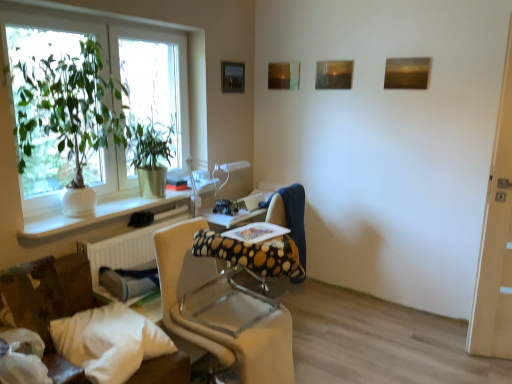
Describe the element at coordinates (95, 215) in the screenshot. The image size is (512, 384). I see `white ceramic pot at left` at that location.

What is the approximate height of matte wooden picture frame at upper center, which is the 2th picture frame in left-to-right order?

9.15 inches.

What do you see at coordinates (284, 75) in the screenshot?
I see `matte wooden picture frame at upper center, which is the 2th picture frame in left-to-right order` at bounding box center [284, 75].

What do you see at coordinates (109, 341) in the screenshot? Image resolution: width=512 pixels, height=384 pixels. I see `white fabric pillow at lower left` at bounding box center [109, 341].

What do you see at coordinates (150, 154) in the screenshot? I see `green glossy plant at left, positioned as the 1th houseplant in back-to-front order` at bounding box center [150, 154].

Describe the element at coordinates (69, 115) in the screenshot. I see `green leafy plant at left, arranged as the 2th houseplant when viewed from the back` at that location.

Locate an element on the screen. The image size is (512, 384). matte wooden picture frame at upper center, which is the second picture frame in right-to-left order is located at coordinates (334, 74).

Image resolution: width=512 pixels, height=384 pixels. I want to click on white ceramic pot at left, so click(95, 215).

Choose the correct answer: Is wooden textured painting at upper right, placed as the 4th picture frame when sorted from left to right, inside white fabric pillow at lower left or outside it?

wooden textured painting at upper right, placed as the 4th picture frame when sorted from left to right, lies outside white fabric pillow at lower left.

From a real-world perspective, which object rests below the other?

white fabric pillow at lower left is physically lower.

Is wooden textured painting at upper right, placed as the 4th picture frame when sorted from left to right, taller or shorter than white fabric pillow at lower left?

Clearly, wooden textured painting at upper right, placed as the 4th picture frame when sorted from left to right, is taller compared to white fabric pillow at lower left.

Looking at this image, between wooden textured painting at upper right, placed as the 4th picture frame when sorted from left to right, and white fabric pillow at lower left, which one has smaller size?

wooden textured painting at upper right, placed as the 4th picture frame when sorted from left to right.

Is white ceramic pot at left aimed at metallic rectangular frame at upper center, the fourth picture frame in the right-to-left sequence?

No, white ceramic pot at left is not aimed at metallic rectangular frame at upper center, the fourth picture frame in the right-to-left sequence.

Is white ceramic pot at left placed right next to metallic rectangular frame at upper center, the fourth picture frame in the right-to-left sequence?

white ceramic pot at left and metallic rectangular frame at upper center, the fourth picture frame in the right-to-left sequence, are clearly separated.

Considering the positions of point (110, 202) and point (241, 74), is point (110, 202) closer or farther from the camera than point (241, 74)?

Point (110, 202).

How distant is metallic rectangular frame at upper center, the fourth picture frame in the right-to-left sequence, from beige fabric chair at center?

1.83 meters.

From a real-world perspective, between metallic rectangular frame at upper center, the fourth picture frame in the right-to-left sequence, and beige fabric chair at center, who is vertically lower?

beige fabric chair at center, from a real-world perspective.

Does metallic rectangular frame at upper center, the fourth picture frame in the right-to-left sequence, have a larger size compared to beige fabric chair at center?

Incorrect, metallic rectangular frame at upper center, the fourth picture frame in the right-to-left sequence, is not larger than beige fabric chair at center.

From a real-world perspective, which object stands above the other?

white fabric pillow at lower left.

Does point (283, 367) appear closer or farther from the camera than point (70, 360)?

Clearly, point (283, 367) is more distant from the camera than point (70, 360).

Who is more distant, beige fabric chair at center or white fabric pillow at lower left?

beige fabric chair at center is further from the camera.

From the image's perspective, between beige fabric chair at center and white fabric pillow at lower left, which one is located above?

beige fabric chair at center.

Between wooden textured painting at upper right, which is the 1th picture frame in right-to-left order, and white textured radiator at lower left, which one appears on the right side from the viewer's perspective?

From the viewer's perspective, wooden textured painting at upper right, which is the 1th picture frame in right-to-left order, appears more on the right side.

Based on the photo, considering the sizes of objects wooden textured painting at upper right, which is the 1th picture frame in right-to-left order, and white textured radiator at lower left in the image provided, who is thinner, wooden textured painting at upper right, which is the 1th picture frame in right-to-left order, or white textured radiator at lower left?

With smaller width is wooden textured painting at upper right, which is the 1th picture frame in right-to-left order.

Who is shorter, wooden textured painting at upper right, which is the 1th picture frame in right-to-left order, or white textured radiator at lower left?

wooden textured painting at upper right, which is the 1th picture frame in right-to-left order.

Would you say matte wooden picture frame at upper center, which is the second picture frame in right-to-left order, is to the left or to the right of white ceramic pot at left in the picture?

matte wooden picture frame at upper center, which is the second picture frame in right-to-left order, is to the right of white ceramic pot at left.

You are a GUI agent. You are given a task and a screenshot of the screen. Output one action in this format:
    pyautogui.click(x=<x>, y=<y>)
    Task: Click on the window sill in front of the matte wooden picture frame at upper center, which is the second picture frame in right-to-left order
    The width and height of the screenshot is (512, 384).
    Given the screenshot: What is the action you would take?
    pyautogui.click(x=95, y=215)

Is matte wooden picture frame at upper center, positioned as the third picture frame in left-to-right order, not close to white ceramic pot at left?

That's right, there is a large distance between matte wooden picture frame at upper center, positioned as the third picture frame in left-to-right order, and white ceramic pot at left.

Considering the relative positions of metallic rectangular frame at upper center, the fourth picture frame in the right-to-left sequence, and matte wooden picture frame at upper center, positioned as the third picture frame in left-to-right order, in the image provided, is metallic rectangular frame at upper center, the fourth picture frame in the right-to-left sequence, behind matte wooden picture frame at upper center, positioned as the third picture frame in left-to-right order,?

Yes, it is.

From a real-world perspective, who is located higher, metallic rectangular frame at upper center, the fourth picture frame in the right-to-left sequence, or matte wooden picture frame at upper center, which is the second picture frame in right-to-left order?

matte wooden picture frame at upper center, which is the second picture frame in right-to-left order, is physically above.

From the picture: Considering the sizes of objects metallic rectangular frame at upper center, the fourth picture frame in the right-to-left sequence, and matte wooden picture frame at upper center, positioned as the third picture frame in left-to-right order, in the image provided, who is taller, metallic rectangular frame at upper center, the fourth picture frame in the right-to-left sequence, or matte wooden picture frame at upper center, positioned as the third picture frame in left-to-right order,?

Standing taller between the two is metallic rectangular frame at upper center, the fourth picture frame in the right-to-left sequence.

From the image's perspective, which is below, metallic rectangular frame at upper center, acting as the 1th picture frame starting from the left, or matte wooden picture frame at upper center, which is the second picture frame in right-to-left order?

matte wooden picture frame at upper center, which is the second picture frame in right-to-left order, from the image's perspective.

The image size is (512, 384). In order to click on pillow on the left of wooden textured painting at upper right, placed as the 4th picture frame when sorted from left to right in this screenshot , I will do `click(109, 341)`.

Locate an element on the screen. The height and width of the screenshot is (384, 512). the 3rd picture frame behind when counting from the white ceramic pot at left is located at coordinates (232, 77).

From the image, which object appears to be farther from polka dot fabric swivel chair at center, wooden textured painting at upper right, placed as the 4th picture frame when sorted from left to right, or matte wooden picture frame at upper center, which is the second picture frame in right-to-left order?

wooden textured painting at upper right, placed as the 4th picture frame when sorted from left to right.

From the image, which object appears to be farther from wooden textured painting at upper right, placed as the 4th picture frame when sorted from left to right, white fabric pillow at lower left or beige fabric chair at center?

white fabric pillow at lower left is further to wooden textured painting at upper right, placed as the 4th picture frame when sorted from left to right.

When comparing their distances from green glossy plant at left, the 2th houseplant from the front, does white textured radiator at lower left or wooden textured painting at upper right, which is the 1th picture frame in right-to-left order, seem closer?

The object closer to green glossy plant at left, the 2th houseplant from the front, is white textured radiator at lower left.

When comparing their distances from metallic rectangular frame at upper center, acting as the 1th picture frame starting from the left, does polka dot fabric swivel chair at center or wooden textured painting at upper right, which is the 1th picture frame in right-to-left order, seem closer?

The object closer to metallic rectangular frame at upper center, acting as the 1th picture frame starting from the left, is polka dot fabric swivel chair at center.

Looking at the image, which one is located further to metallic rectangular frame at upper center, acting as the 1th picture frame starting from the left, white textured radiator at lower left or matte wooden picture frame at upper center, which is the second picture frame in right-to-left order?

Based on the image, white textured radiator at lower left appears to be further to metallic rectangular frame at upper center, acting as the 1th picture frame starting from the left.

Based on their spatial positions, is green glossy plant at left, positioned as the 1th houseplant in back-to-front order, or matte wooden picture frame at upper center, the third picture frame viewed from the right, further from white fabric pillow at lower left?

matte wooden picture frame at upper center, the third picture frame viewed from the right.

Which object lies nearer to the anchor point matte wooden picture frame at upper center, the third picture frame viewed from the right, white ceramic pot at left or green glossy plant at left, positioned as the 1th houseplant in back-to-front order?

The object closer to matte wooden picture frame at upper center, the third picture frame viewed from the right, is green glossy plant at left, positioned as the 1th houseplant in back-to-front order.

When comparing their distances from metallic rectangular frame at upper center, acting as the 1th picture frame starting from the left, does white fabric pillow at lower left or matte wooden picture frame at upper center, which is the 2th picture frame in left-to-right order, seem closer?

Among the two, matte wooden picture frame at upper center, which is the 2th picture frame in left-to-right order, is located nearer to metallic rectangular frame at upper center, acting as the 1th picture frame starting from the left.

I want to click on chair between green glossy plant at left, the 2th houseplant from the front, and white fabric pillow at lower left in the up-down direction, so tap(221, 311).

This screenshot has height=384, width=512. What are the coordinates of `radiator between polka dot fabric swivel chair at center and matte wooden picture frame at upper center, positioned as the third picture frame in left-to-right order, along the z-axis` in the screenshot? It's located at (127, 245).

Locate an element on the screen. chair between green leafy plant at left, the 1th houseplant from the front, and white fabric pillow at lower left from top to bottom is located at coordinates (221, 311).

What are the coordinates of `radiator between white ceramic pot at left and polka dot fabric swivel chair at center in the horizontal direction` in the screenshot? It's located at (127, 245).